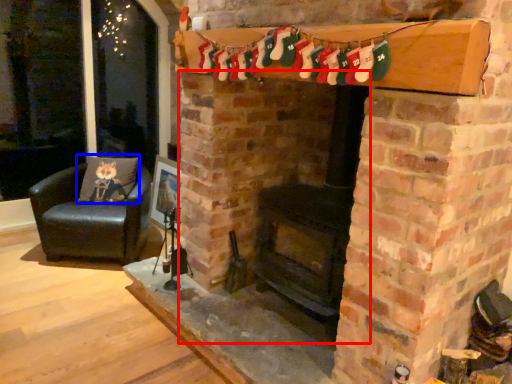
Question: Among these objects, which one is farthest to the camera, fireplace (highlighted by a red box) or pillow (highlighted by a blue box)?

Choices:
 (A) fireplace
 (B) pillow

Answer: (B)